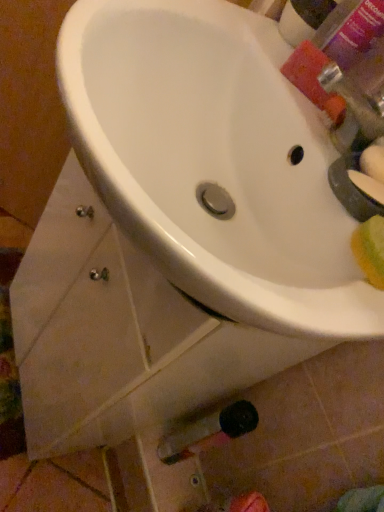
Question: Can you see pink matte bottle at upper right touching white glossy sink at center?

Choices:
 (A) no
 (B) yes

Answer: (A)

Question: From the image's perspective, does pink matte bottle at upper right appear higher than white glossy sink at center?

Choices:
 (A) yes
 (B) no

Answer: (A)

Question: Would you say pink matte bottle at upper right is outside white glossy sink at center?

Choices:
 (A) yes
 (B) no

Answer: (A)

Question: Considering the relative positions of pink matte bottle at upper right and white glossy sink at center in the image provided, is pink matte bottle at upper right to the left of white glossy sink at center from the viewer's perspective?

Choices:
 (A) no
 (B) yes

Answer: (A)

Question: Does pink matte bottle at upper right have a greater width compared to white glossy sink at center?

Choices:
 (A) no
 (B) yes

Answer: (A)

Question: Visually, is pink matte bottle at upper right positioned to the left or to the right of green matte soap at right?

Choices:
 (A) left
 (B) right

Answer: (A)

Question: Is pink matte bottle at upper right wider or thinner than green matte soap at right?

Choices:
 (A) wide
 (B) thin

Answer: (A)

Question: From the image's perspective, is pink matte bottle at upper right positioned above or below green matte soap at right?

Choices:
 (A) below
 (B) above

Answer: (B)

Question: Is pink matte bottle at upper right situated inside green matte soap at right or outside?

Choices:
 (A) outside
 (B) inside

Answer: (A)

Question: In terms of height, does green matte soap at right look taller or shorter compared to pink matte bottle at upper right?

Choices:
 (A) tall
 (B) short

Answer: (B)

Question: Looking at their shapes, would you say green matte soap at right is wider or thinner than pink matte bottle at upper right?

Choices:
 (A) wide
 (B) thin

Answer: (B)

Question: Based on their sizes in the image, would you say green matte soap at right is bigger or smaller than pink matte bottle at upper right?

Choices:
 (A) big
 (B) small

Answer: (B)

Question: From a real-world perspective, is green matte soap at right physically located above or below pink matte bottle at upper right?

Choices:
 (A) above
 (B) below

Answer: (B)

Question: Considering their positions, is green matte soap at right located in front of or behind white glossy sink at center?

Choices:
 (A) behind
 (B) front

Answer: (A)

Question: In terms of size, does green matte soap at right appear bigger or smaller than white glossy sink at center?

Choices:
 (A) small
 (B) big

Answer: (A)